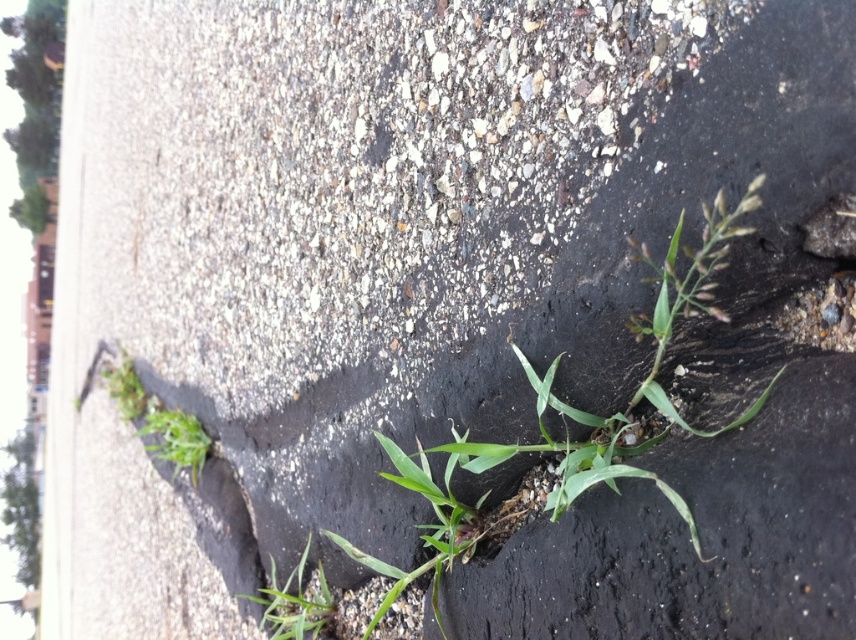
Question: Which point is closer to the camera?

Choices:
 (A) (195, 449)
 (B) (256, 600)

Answer: (B)

Question: In this image, where is green leafy plant at lower center located relative to green leafy plant at lower left?

Choices:
 (A) below
 (B) above

Answer: (A)

Question: Which point is closer to the camera taking this photo?

Choices:
 (A) (271, 620)
 (B) (197, 432)

Answer: (A)

Question: Does green leafy plant at lower center have a greater width compared to green leafy plant at lower left?

Choices:
 (A) no
 (B) yes

Answer: (A)

Question: Which point is farther to the camera?

Choices:
 (A) green leafy plant at lower center
 (B) green leafy plant at lower left

Answer: (B)

Question: Does green leafy plant at lower center appear over green leafy plant at lower left?

Choices:
 (A) no
 (B) yes

Answer: (A)